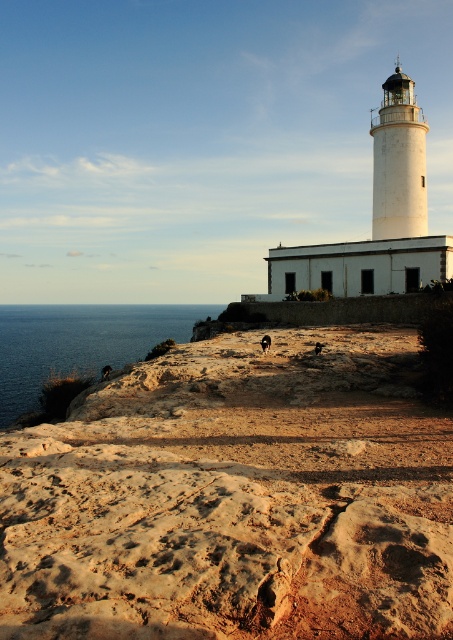
Question: Which of the following is the closest to the observer?

Choices:
 (A) blue water at lower left
 (B) rustic stone beach at center

Answer: (B)

Question: Among these objects, which one is farthest from the camera?

Choices:
 (A) rustic stone beach at center
 (B) blue water at lower left

Answer: (B)

Question: Does rustic stone beach at center appear over blue water at lower left?

Choices:
 (A) no
 (B) yes

Answer: (A)

Question: Does rustic stone beach at center appear under blue water at lower left?

Choices:
 (A) no
 (B) yes

Answer: (B)

Question: Does rustic stone beach at center have a smaller size compared to blue water at lower left?

Choices:
 (A) yes
 (B) no

Answer: (A)